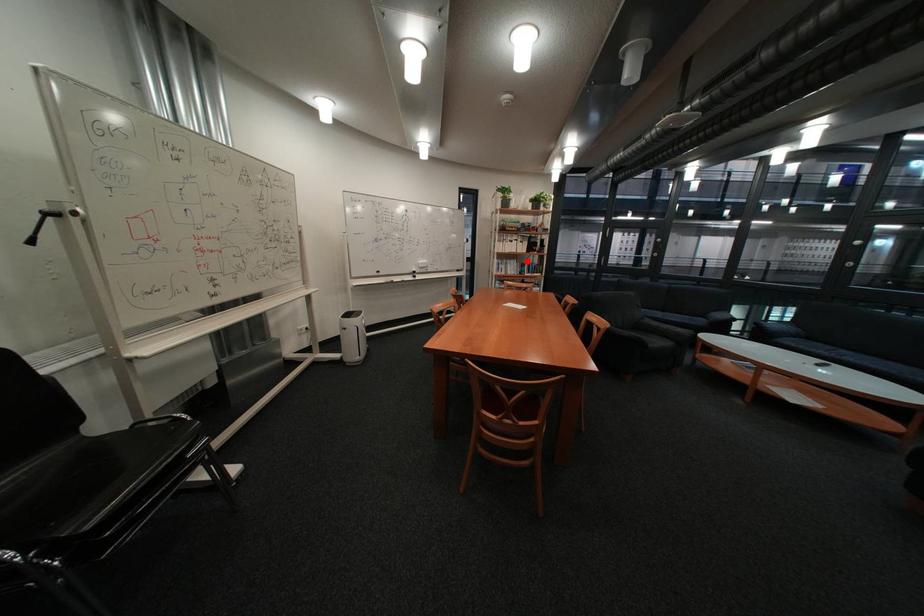
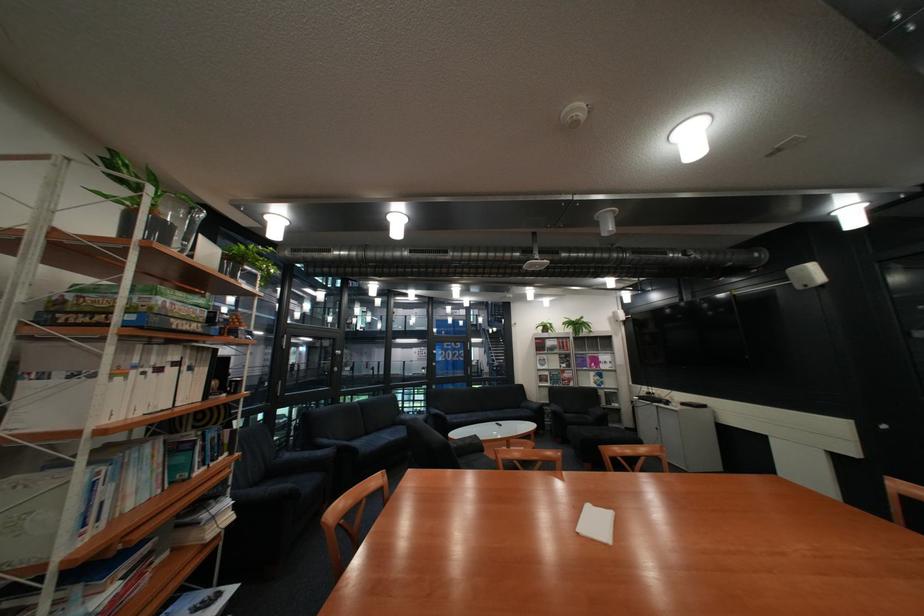
Question: I am providing you with two images of the same scene from different viewpoints. In image1, a red point is highlighted. Considering the same 3D point in image2, which of the following is correct?

Choices:
 (A) It is closer
 (B) It is farther

Answer: (B)